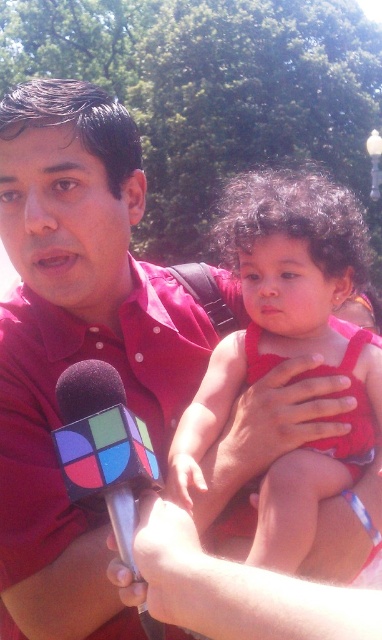
Based on the photo, you are a photographer at a public event. You need to capture a clear shot of both the matte red dress at center and the rubberized plastic microphone at lower left. Based on their positions, which object should you focus on first to ensure both are in focus?

The matte red dress at center is closer to the viewer than the rubberized plastic microphone at lower left. To ensure both are in focus, you should focus on the matte red dress at center first since it is closer, and the microphone will fall within the depth of field if properly adjusted.

You are a photographer at the event and need to capture a closeup of the matte red dress at center while also including the rubberized plastic microphone at lower left in the frame. Given their sizes, will the microphone fit entirely within the dress area in the photo?

The matte red dress at center is wider than the rubberized plastic microphone at lower left, so the microphone will fit entirely within the dress area in the photo.

You are a photographer at the event. You need to capture a photo where the matte red dress at center is clearly visible without being blocked by the rubberized plastic microphone at lower left. Based on their positions, is this possible?

The matte red dress at center is above the rubberized plastic microphone at lower left, so it will not block the view of the dress. Therefore, it is possible to capture a clear photo of the matte red dress at center without obstruction.